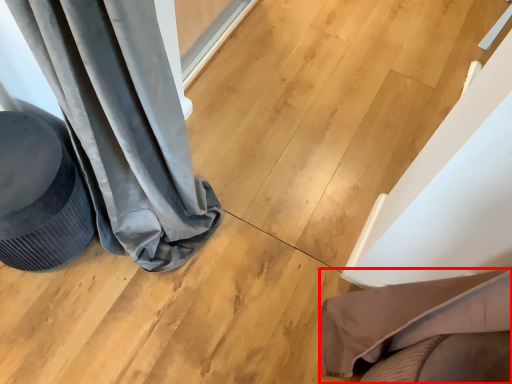
Question: In this image, where is furniture (annotated by the red box) located relative to swivel chair?

Choices:
 (A) left
 (B) right

Answer: (B)